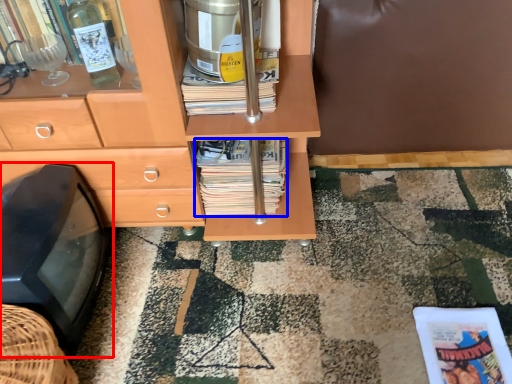
Question: Which object appears farthest to the camera in this image, flat (highlighted by a red box) or magazine (highlighted by a blue box)?

Choices:
 (A) flat
 (B) magazine

Answer: (B)